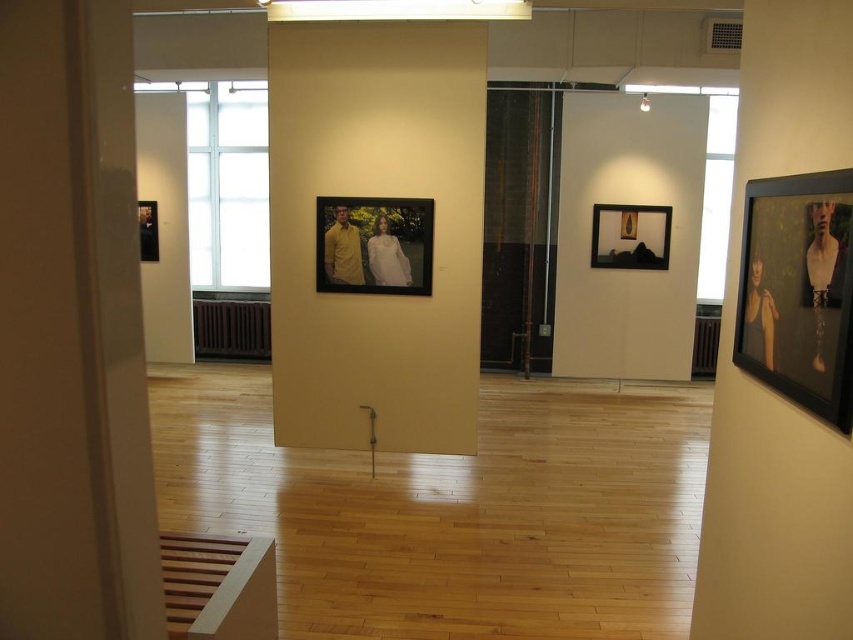
You are an art curator planning to hang two new frames in the gallery. The first is a matte plastic picture frame at center and the second is a matte black picture frame at center. Given their sizes, which frame should you place higher on the wall to maintain visual balance?

The matte plastic picture frame at center has a greater height compared to the matte black picture frame at center, so placing the taller matte plastic picture frame at center lower on the wall and the smaller matte black picture frame at center higher up would help maintain visual balance.

Based on the photo, you are an interior designer planning to install a new wall fixture in this gallery. The existing point at coordinates (374, 244) marks the center of a matte plastic picture frame. If you want to place a new circular light fixture with a diameter of 0.2 meters, will it overlap with the existing frame?

The point at coordinates (374, 244) marks the center of the matte plastic picture frame at center. Since the new light fixture has a diameter of 0.2 meters, its radius would be 0.1 meters. To determine overlap, the distance from the center of the frame to the edge of the new fixture must be less than the radius. However, without knowing the exact dimensions of the existing frame, it is impossible to calculate the required distance. Therefore, the overlap cannot be confirmed with the given information.